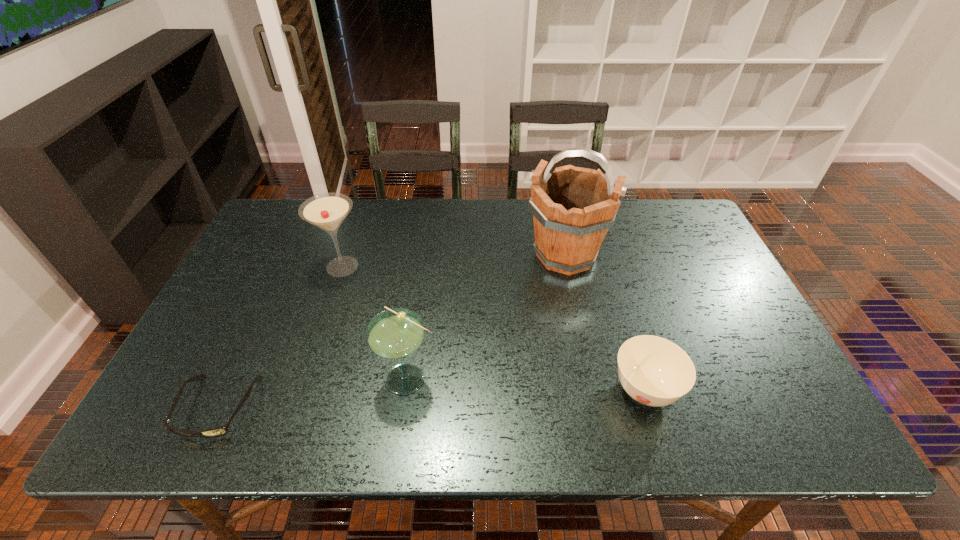
The height and width of the screenshot is (540, 960). In the image, there is a desktop. Find the location of `blank space at the far left corner`. blank space at the far left corner is located at coordinates (284, 224).

The width and height of the screenshot is (960, 540). Find the location of `free space at the far right corner of the desktop`. free space at the far right corner of the desktop is located at coordinates (679, 199).

At what (x,y) coordinates should I click in order to perform the action: click on free space between the spectacles and the fourth tallest object. Please return your answer as a coordinate pair (x, y). Looking at the image, I should click on (431, 399).

In order to click on free point between the second shortest object and the nearer martini in this screenshot , I will do `click(527, 384)`.

Find the location of a particular element. free space between the sugar bowl and the leftmost object is located at coordinates (431, 399).

You are a GUI agent. You are given a task and a screenshot of the screen. Output one action in this format:
    pyautogui.click(x=<x>, y=<y>)
    Task: Click on the free space between the sugar bowl and the leftmost object
    
    Given the screenshot: What is the action you would take?
    pyautogui.click(x=431, y=399)

At what (x,y) coordinates should I click in order to perform the action: click on vacant area between the tallest object and the sugar bowl. Please return your answer as a coordinate pair (x, y). Looking at the image, I should click on (605, 323).

Identify the location of vacant point located between the right martini and the second shortest object. Image resolution: width=960 pixels, height=540 pixels. (527, 384).

Image resolution: width=960 pixels, height=540 pixels. Find the location of `vacant area that lies between the leftmost object and the left martini`. vacant area that lies between the leftmost object and the left martini is located at coordinates (280, 336).

Find the location of a particular element. vacant area that lies between the farther martini and the tallest object is located at coordinates (454, 261).